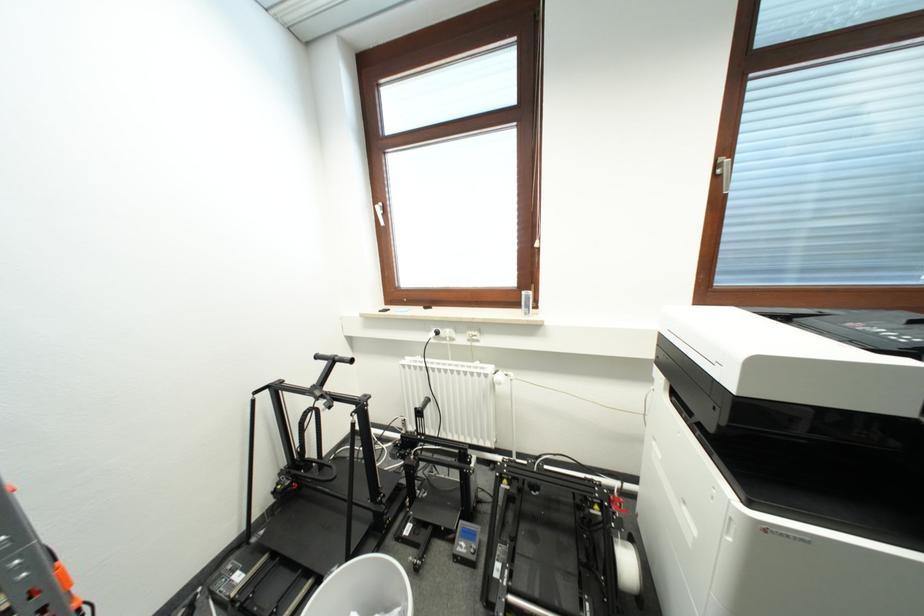
Identify the location of printer scanner lid. (919, 451).